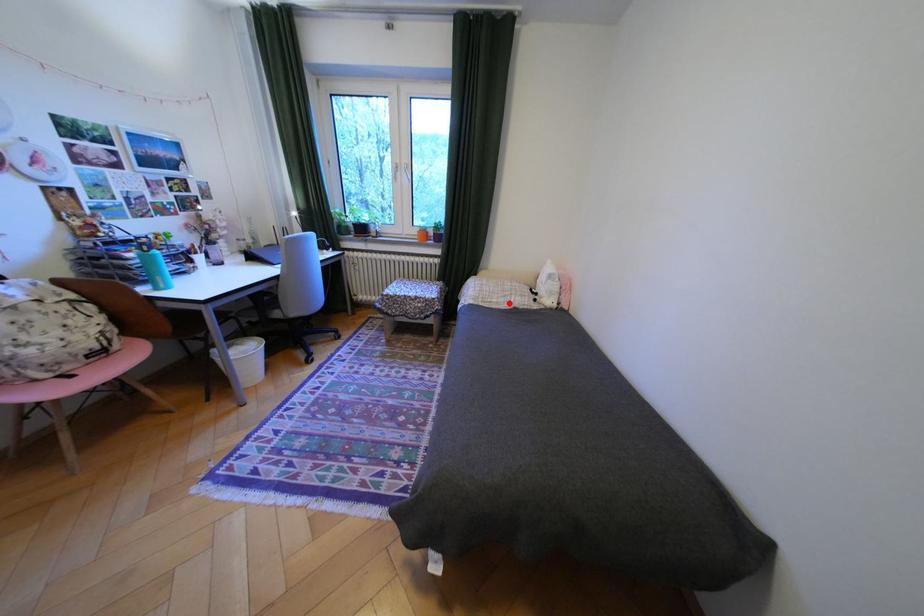
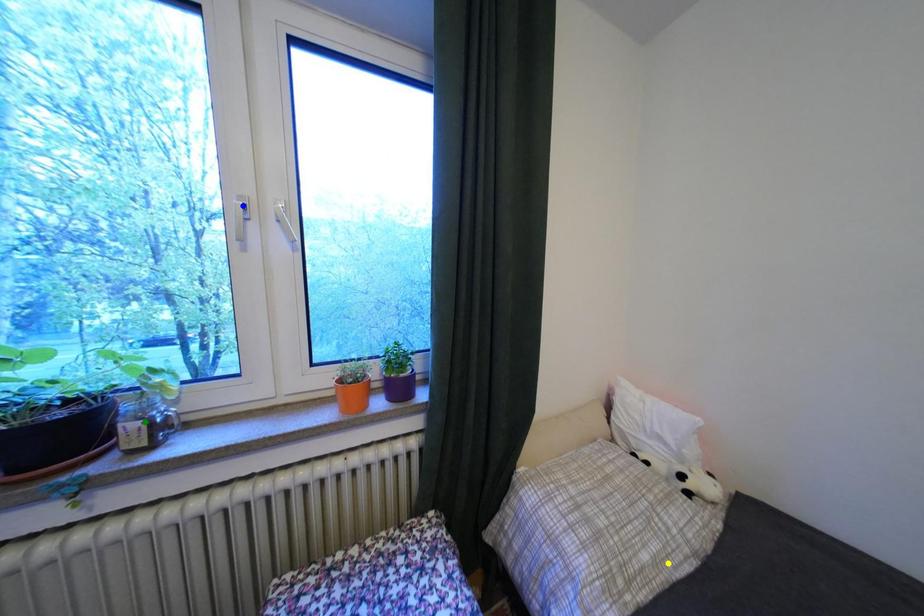
Question: I am providing you with two images of the same scene from different viewpoints. A red point is marked on the first image. You are given multiple points on the second image. Which point in image 2 is actually the same real-world point as the red point in image 1?

Choices:
 (A) yellow point
 (B) blue point
 (C) green point

Answer: (A)